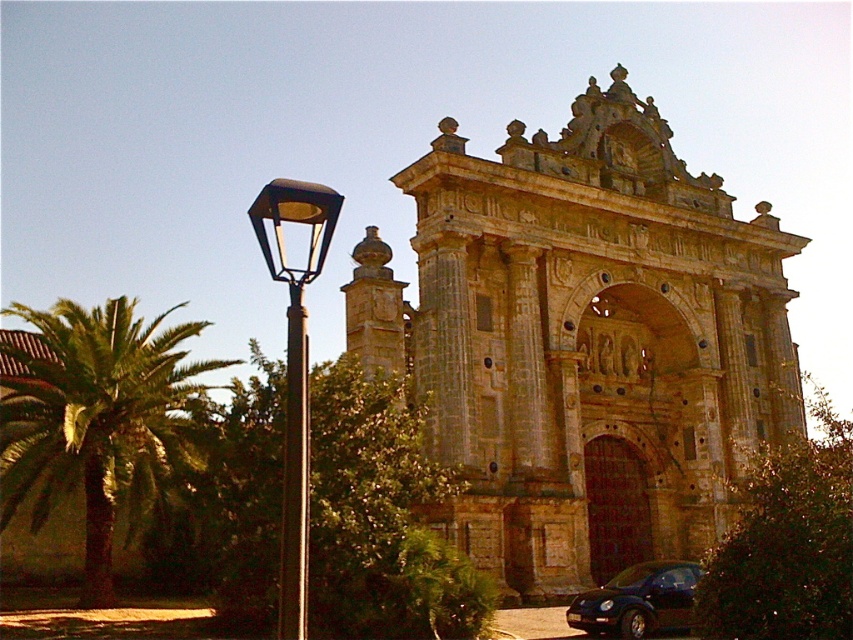
Between point (300, 205) and point (300, 282), which one is positioned in front?

Positioned in front is point (300, 205).

Who is positioned more to the right, black metal street light at left or brown polished pole at left?

brown polished pole at left

Between point (289, 620) and point (289, 465), which one is positioned in front?

Point (289, 620) is more forward.

The width and height of the screenshot is (853, 640). Identify the location of black metal street light at left. (294, 362).

Is point (303, 563) closer to camera compared to point (666, 618)?

Yes.

The height and width of the screenshot is (640, 853). What are the coordinates of `black metal street light at left` in the screenshot? It's located at (294, 362).

Is stone carved church at center closer to camera compared to shiny black car at lower right?

No, it is behind shiny black car at lower right.

Between stone carved church at center and shiny black car at lower right, which one is positioned lower?

Positioned lower is shiny black car at lower right.

You are a GUI agent. You are given a task and a screenshot of the screen. Output one action in this format:
    pyautogui.click(x=<x>, y=<y>)
    Task: Click on the stone carved church at center
    
    Given the screenshot: What is the action you would take?
    pyautogui.click(x=583, y=340)